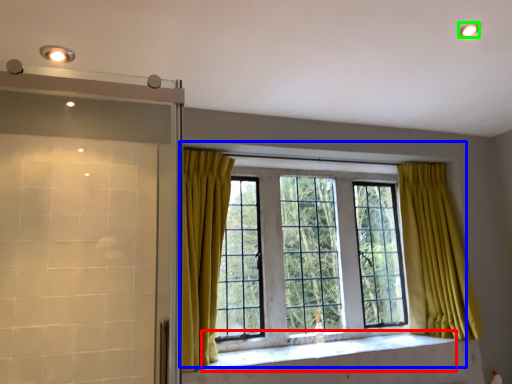
Question: Based on their relative distances, which object is farther from window sill (highlighted by a red box)? Choose from window (highlighted by a blue box) and lighting (highlighted by a green box).

Choices:
 (A) window
 (B) lighting

Answer: (B)